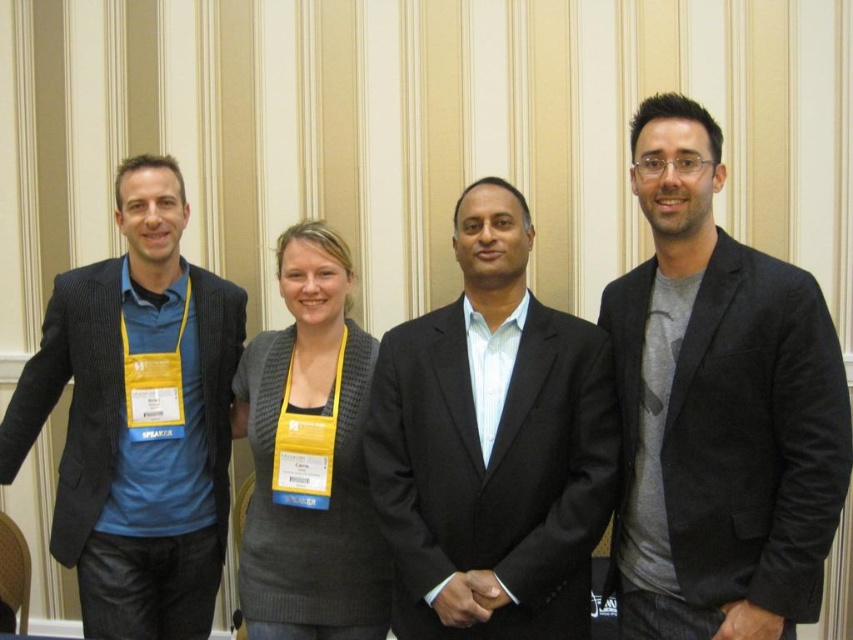
Between matte black suit at center and matte black blazer at left, which one is positioned lower?

matte black blazer at left is lower down.

Is point (486, 269) farther from camera compared to point (91, 348)?

No, it is in front of (91, 348).

The width and height of the screenshot is (853, 640). In order to click on matte black suit at center in this screenshot , I will do `click(491, 445)`.

Does point (697, 630) come in front of point (224, 396)?

Yes, it is in front of point (224, 396).

Who is higher up, dark gray cotton blazer at right or matte black blazer at left?

dark gray cotton blazer at right is higher up.

What do you see at coordinates (718, 410) in the screenshot? I see `dark gray cotton blazer at right` at bounding box center [718, 410].

You are a GUI agent. You are given a task and a screenshot of the screen. Output one action in this format:
    pyautogui.click(x=<x>, y=<y>)
    Task: Click on the dark gray cotton blazer at right
    The height and width of the screenshot is (640, 853).
    Given the screenshot: What is the action you would take?
    pyautogui.click(x=718, y=410)

Who is positioned more to the left, dark gray cotton blazer at right or matte black suit at center?

matte black suit at center

The image size is (853, 640). Describe the element at coordinates (718, 410) in the screenshot. I see `dark gray cotton blazer at right` at that location.

Does point (752, 458) come behind point (471, 484)?

No, it is in front of (471, 484).

Where is `dark gray cotton blazer at right`? dark gray cotton blazer at right is located at coordinates (718, 410).